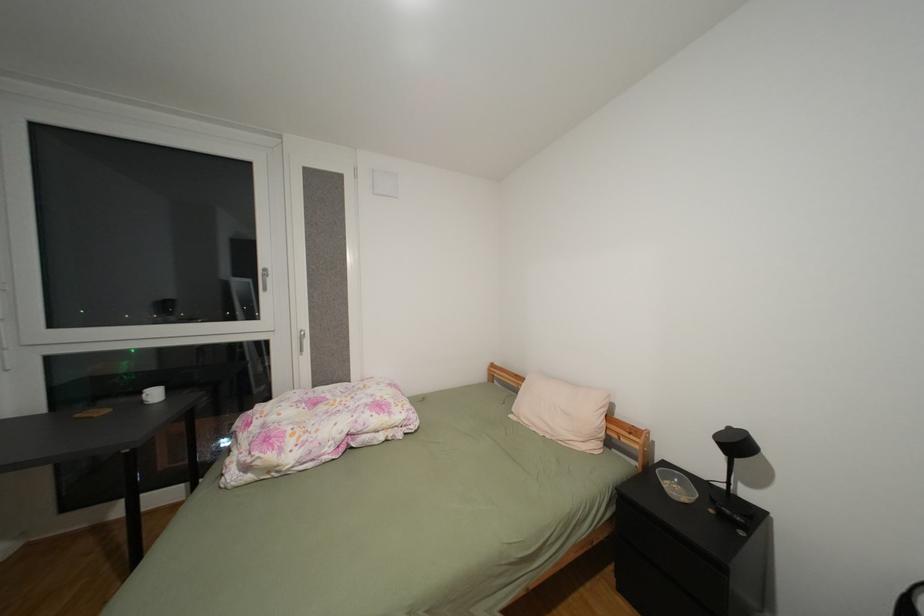
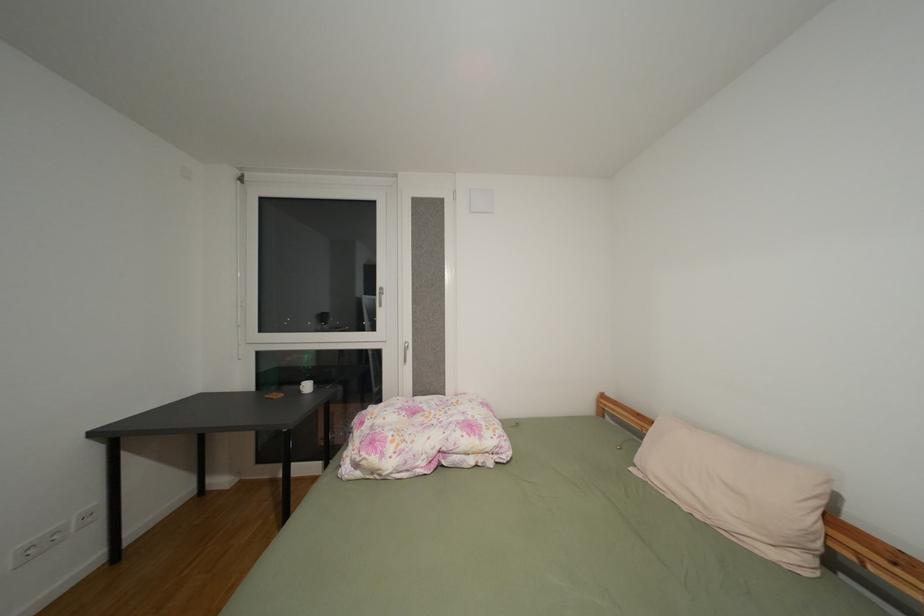
Question: How did the camera likely rotate?

Choices:
 (A) Left
 (B) Right
 (C) Up
 (D) Down

Answer: (A)